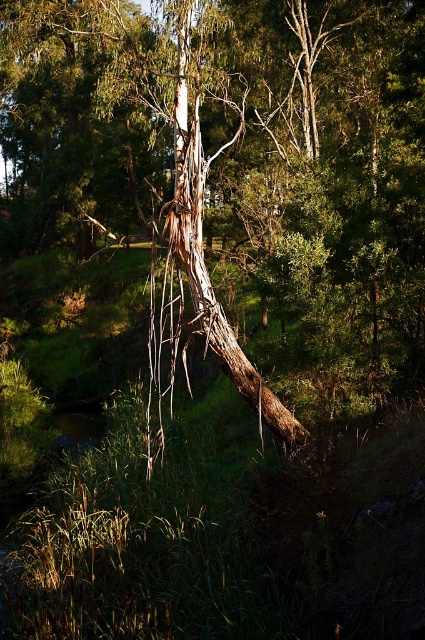
Is brown bark tree at center further to camera compared to brown rough bark tree trunk at center?

No, brown bark tree at center is in front of brown rough bark tree trunk at center.

Which is below, brown bark tree at center or brown rough bark tree trunk at center?

brown rough bark tree trunk at center

Find the location of a particular element. Image resolution: width=425 pixels, height=640 pixels. brown bark tree at center is located at coordinates (237, 157).